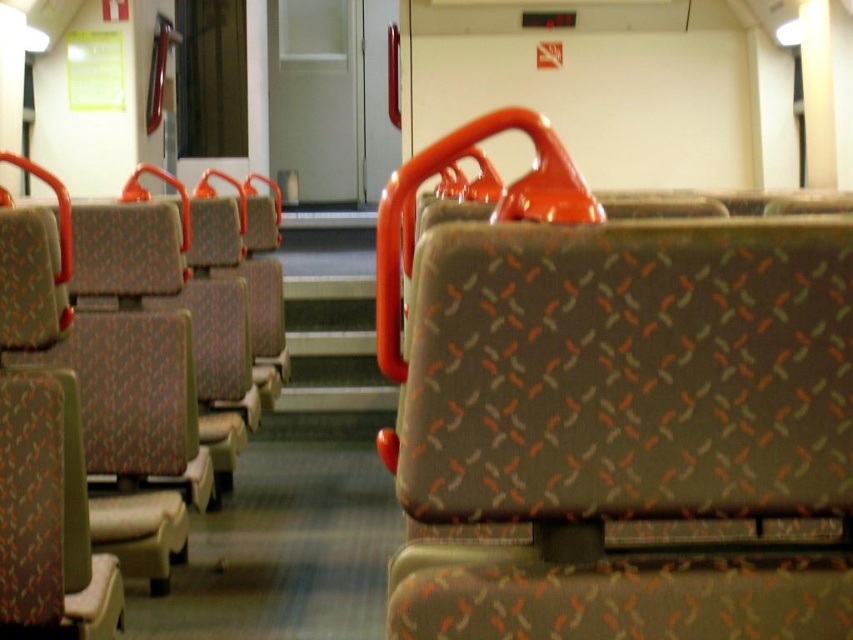
Question: Is textured fabric seat at center bigger than patterned fabric seat at center?

Choices:
 (A) no
 (B) yes

Answer: (A)

Question: Does textured fabric seat at center have a smaller size compared to patterned fabric seat at center?

Choices:
 (A) no
 (B) yes

Answer: (B)

Question: Among these points, which one is nearest to the camera?

Choices:
 (A) (164, 410)
 (B) (844, 589)

Answer: (B)

Question: Among these points, which one is nearest to the camera?

Choices:
 (A) (440, 499)
 (B) (117, 321)

Answer: (A)

Question: Can you confirm if textured fabric seat at center is wider than patterned fabric seat at center?

Choices:
 (A) yes
 (B) no

Answer: (A)

Question: Which point is farther from the camera taking this photo?

Choices:
 (A) (51, 237)
 (B) (415, 346)

Answer: (A)